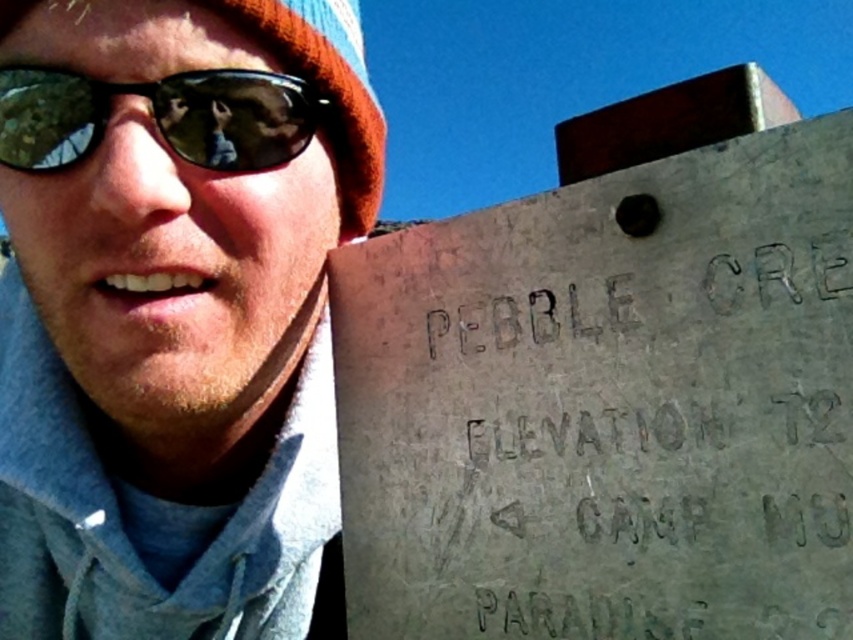
You are a hiker who just arrived at a trailhead and see the matte gray concrete sign at upper right and the orange knit hat at upper left. Which object is bigger?

The matte gray concrete sign at upper right is larger in size than orange knit hat at upper left, so the matte gray concrete sign at upper right is bigger.

You are a hiker who just arrived at the trailhead and see the matte gray concrete sign at upper right and the green reflective lens at left. Which object is closer to the ground?

The matte gray concrete sign at upper right is positioned under the green reflective lens at left, so it is closer to the ground.